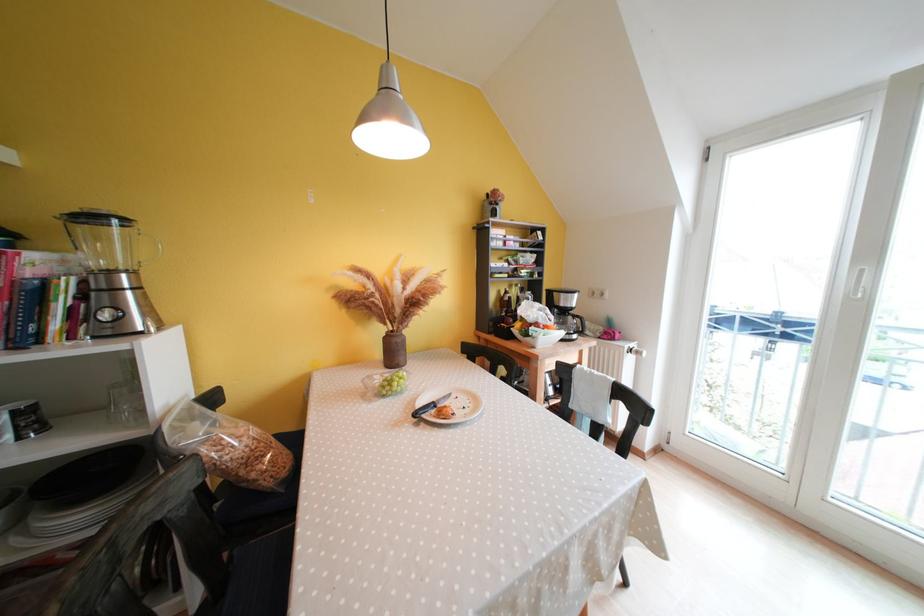
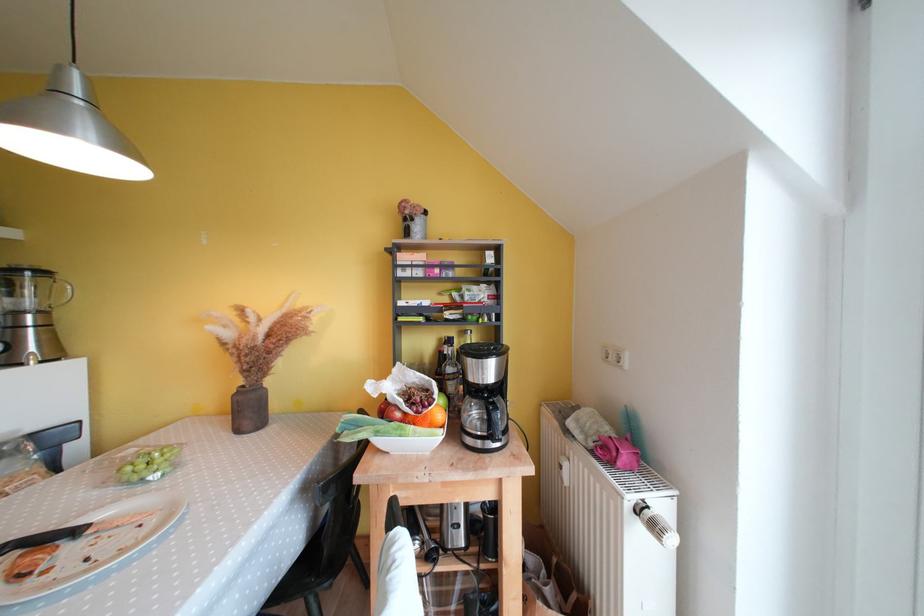
Where in the second image is the point corresponding to pixel 605 342 from the first image?

(599, 456)